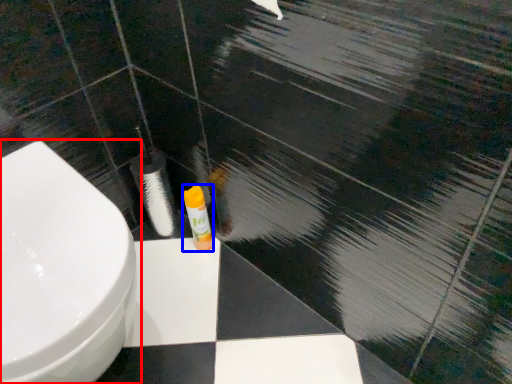
Question: Which point is further to the camera, toilet (highlighted by a red box) or toiletry (highlighted by a blue box)?

Choices:
 (A) toilet
 (B) toiletry

Answer: (B)